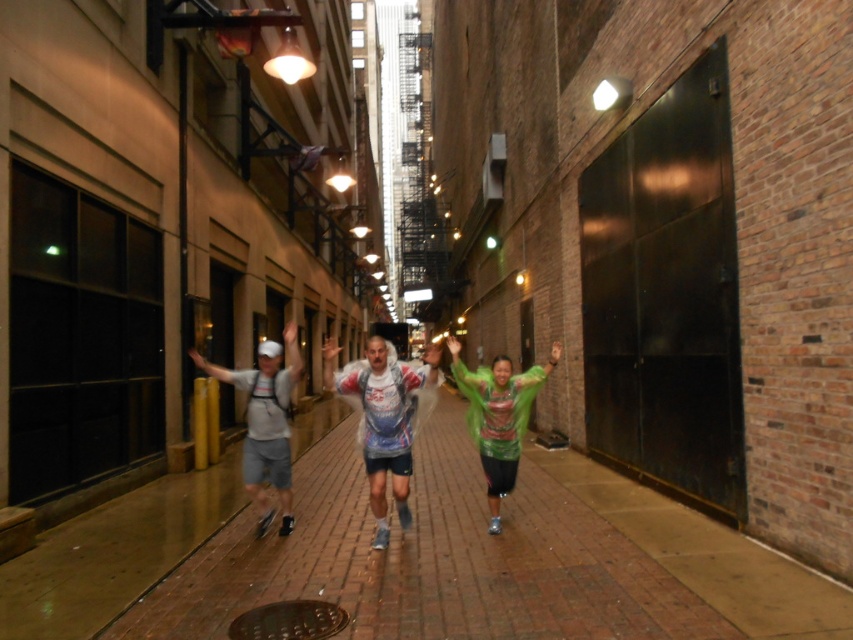
Question: Considering the relative positions of brick pavement at center and green matte jacket at center in the image provided, where is brick pavement at center located with respect to green matte jacket at center?

Choices:
 (A) above
 (B) below

Answer: (B)

Question: Which point is farther to the camera?

Choices:
 (A) (271, 477)
 (B) (511, 438)
 (C) (315, 609)
 (D) (270, 550)

Answer: (A)

Question: Which object is positioned farthest from the white matte running suit at center?

Choices:
 (A) green matte jacket at center
 (B) brick pavement at center

Answer: (B)

Question: Does white matte running suit at center appear under brown textured manhole cover at lower center?

Choices:
 (A) no
 (B) yes

Answer: (A)

Question: In this image, where is white matte shorts at left located relative to green matte jacket at center?

Choices:
 (A) above
 (B) below

Answer: (B)

Question: Based on their relative distances, which object is nearer to the white matte shorts at left?

Choices:
 (A) white matte running suit at center
 (B) brown textured manhole cover at lower center
 (C) brick pavement at center
 (D) green matte jacket at center

Answer: (A)